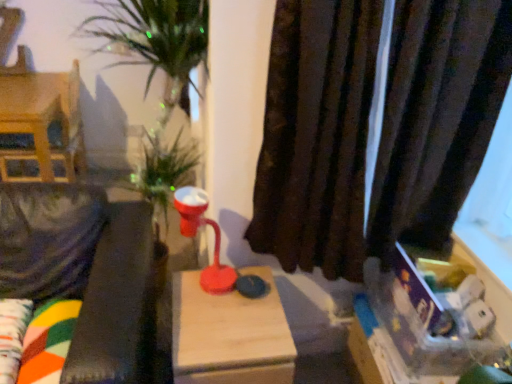
Question: Looking at their shapes, would you say brown velvet curtain at right is wider or thinner than wooden dollhouse at left?

Choices:
 (A) thin
 (B) wide

Answer: (A)

Question: In terms of height, does brown velvet curtain at right look taller or shorter compared to wooden dollhouse at left?

Choices:
 (A) tall
 (B) short

Answer: (A)

Question: Based on their relative distances, which object is farther from the matte plastic table lamp at center?

Choices:
 (A) wooden dollhouse at left
 (B) brown velvet curtain at right
 (C) velvet green couch at left
 (D) wooden table at center

Answer: (A)

Question: Estimate the real-world distances between objects in this image. Which object is closer to the velvet green couch at left?

Choices:
 (A) matte plastic table lamp at center
 (B) brown velvet curtain at right
 (C) wooden dollhouse at left
 (D) wooden table at center

Answer: (D)